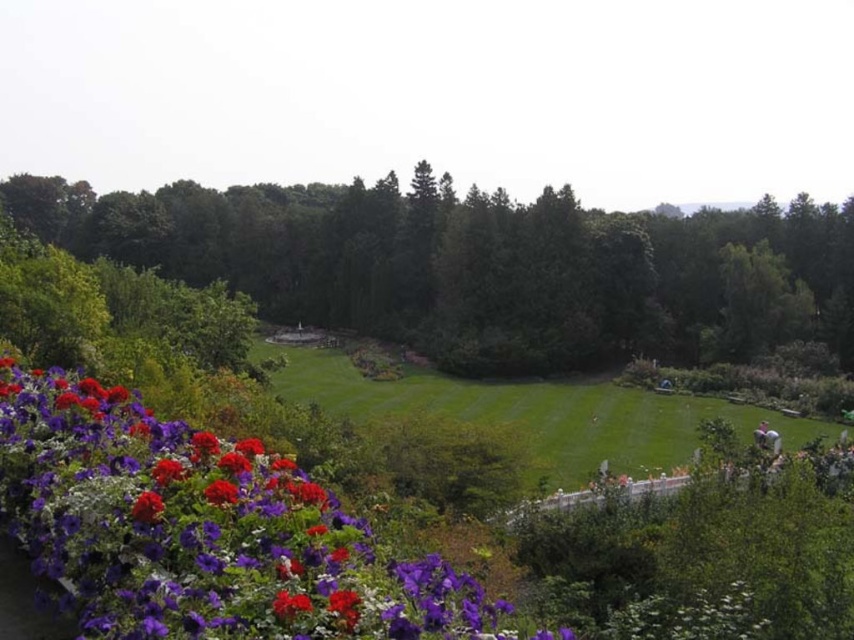
You are planning to create a miniature garden and need to know the relative sizes of the purple matte flower at lower left and the green grass at center. Which one is smaller?

The purple matte flower at lower left is smaller than the green grass at center.

You are standing in the garden looking at the green leafy tree at left and the purple matte flower at lower left. Which object is positioned more to the left side of the garden?

The green leafy tree at left is positioned more to the left side of the garden than the purple matte flower at lower left.